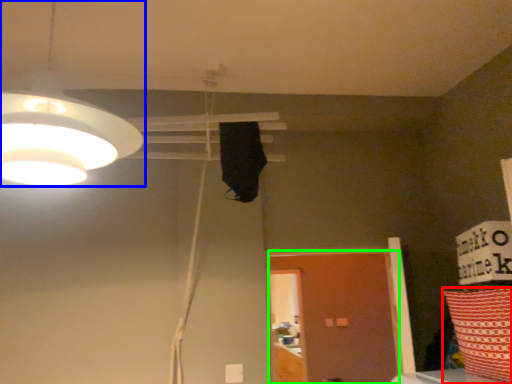
Question: Which object is the closest to the pillow (highlighted by a red box)? Choose among these: lamp (highlighted by a blue box) or door (highlighted by a green box).

Choices:
 (A) lamp
 (B) door

Answer: (A)